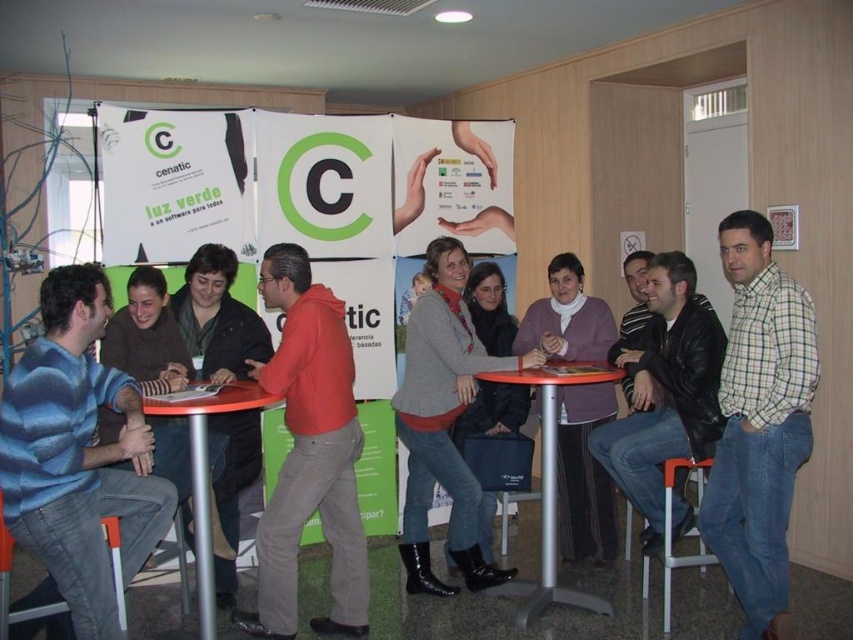
Question: Which object is closer to the camera taking this photo?

Choices:
 (A) orange plastic stool at lower right
 (B) matte gray sweater at center
 (C) plaid cotton shirt at center

Answer: (A)

Question: Observing the image, what is the correct spatial positioning of reddish-orange hoodie at center in reference to metallic silver table at center?

Choices:
 (A) right
 (B) left

Answer: (B)

Question: Considering the real-world distances, which object is closest to the plaid cotton shirt at center?

Choices:
 (A) leather jacket at center
 (B) orange plastic stool at lower right
 (C) matte gray sweater at center

Answer: (A)

Question: Can you confirm if leather jacket at center is positioned above plaid cotton shirt at center?

Choices:
 (A) yes
 (B) no

Answer: (A)

Question: Which object is the farthest from the plaid cotton shirt at center?

Choices:
 (A) red hoodie at center
 (B) reddish-orange hoodie at center
 (C) orange plastic stool at lower right
 (D) matte plastic table at center

Answer: (B)

Question: Is reddish-orange hoodie at center to the right of matte plastic table at center from the viewer's perspective?

Choices:
 (A) yes
 (B) no

Answer: (B)